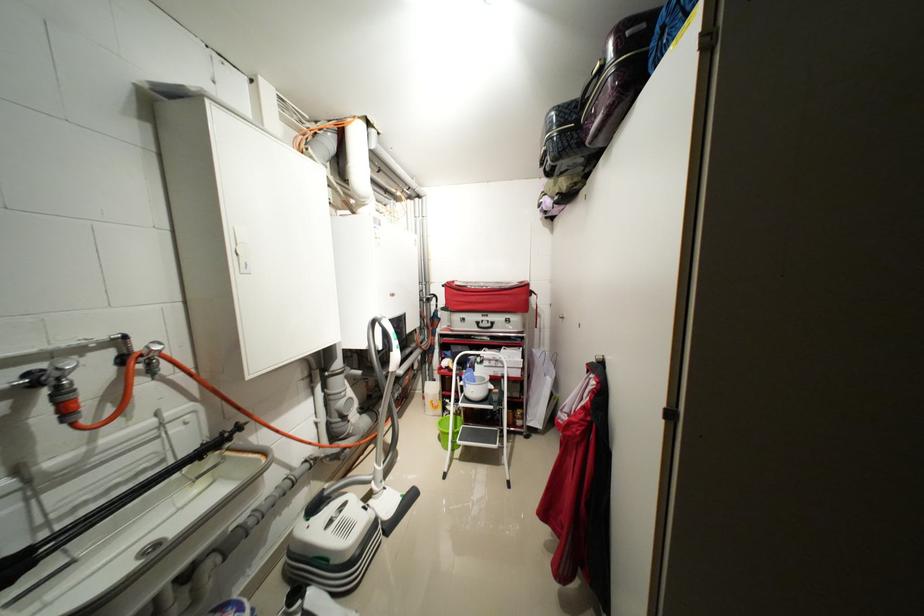
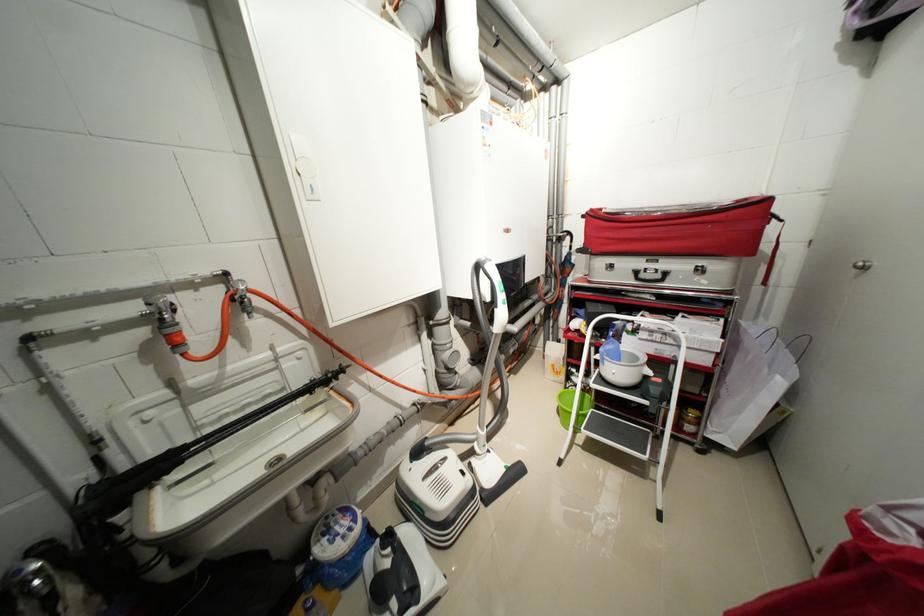
Question: The first image is from the beginning of the video and the second image is from the end. How did the camera likely rotate when shooting the video?

Choices:
 (A) Left
 (B) Right
 (C) Up
 (D) Down

Answer: (A)